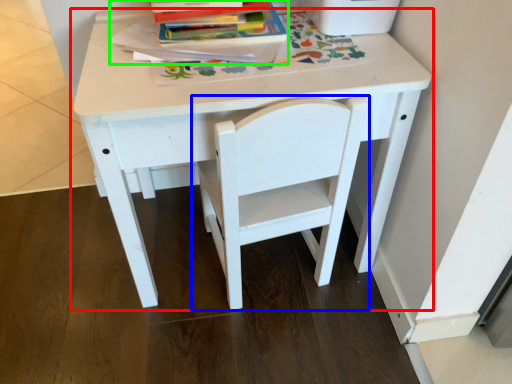
Question: Based on their relative distances, which object is farther from table (highlighted by a red box)? Choose from chair (highlighted by a blue box) and paperback book (highlighted by a green box).

Choices:
 (A) chair
 (B) paperback book

Answer: (B)